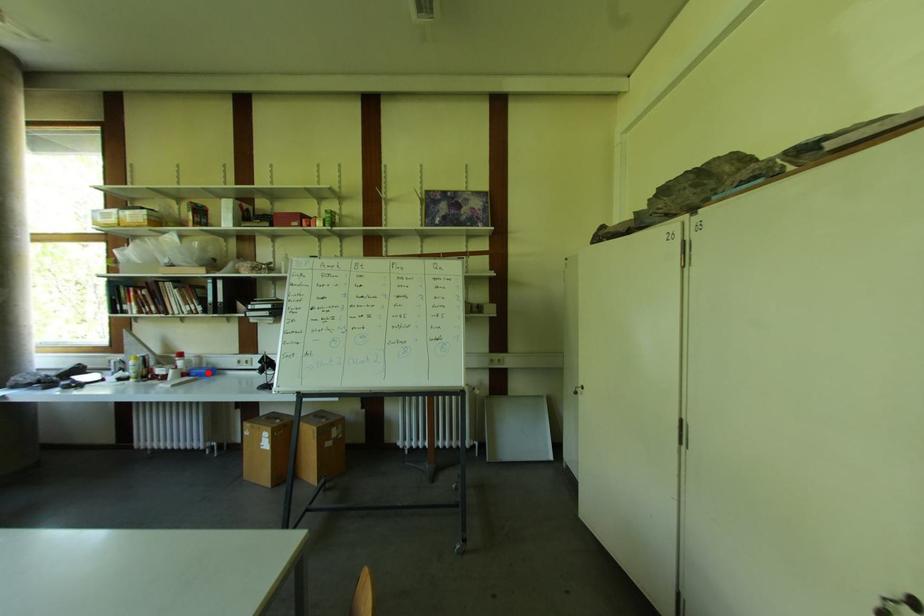
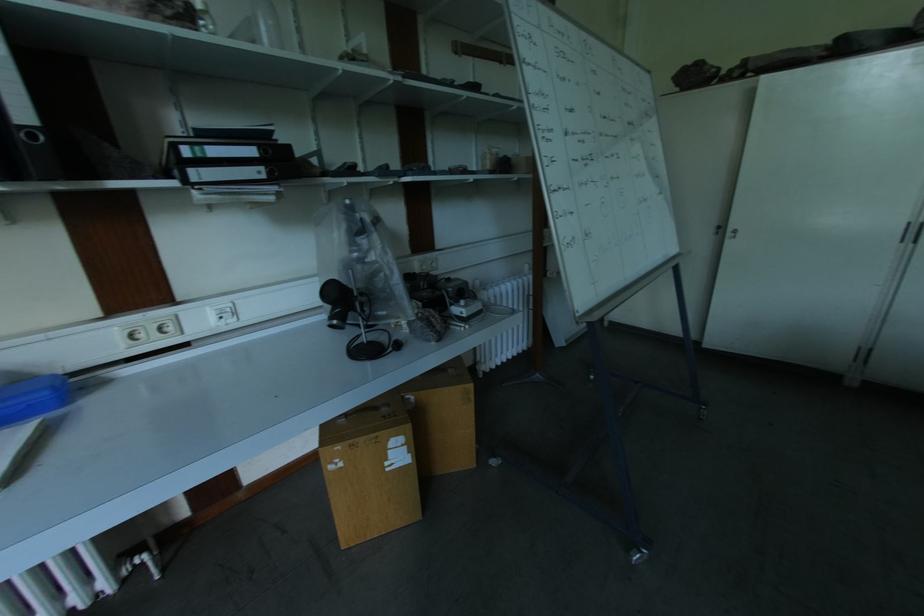
Find the pixel in the second image that matches the highlighted location in the first image.

(46, 395)